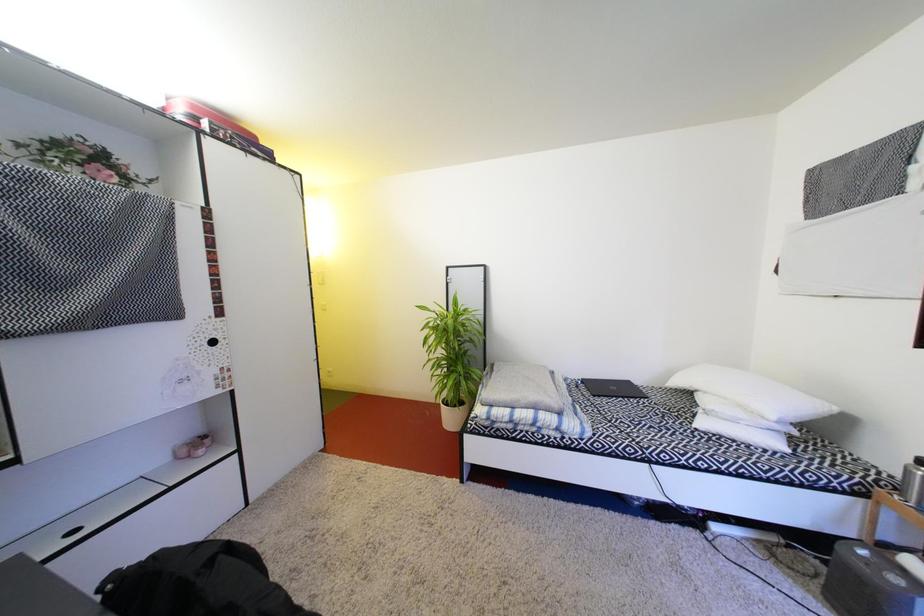
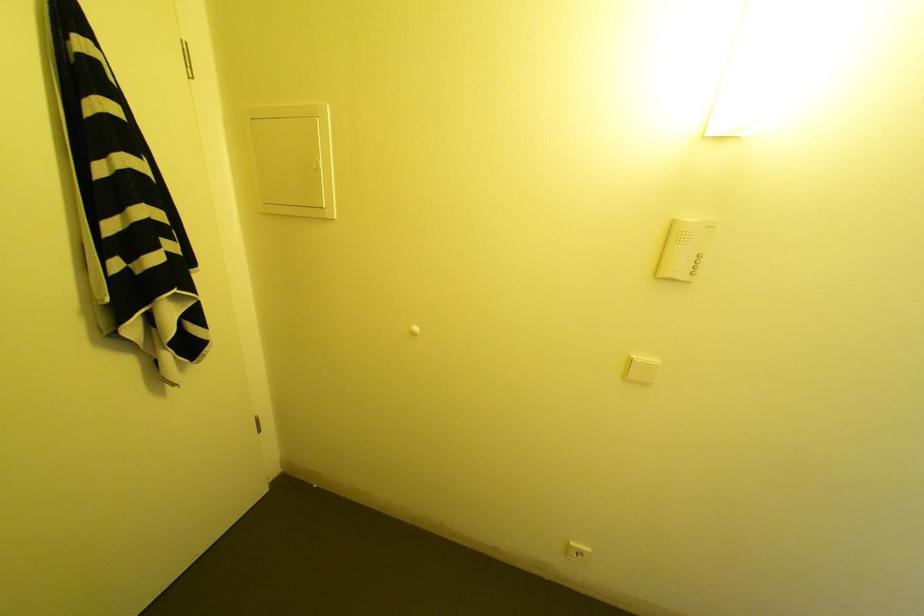
Which direction would the cameraman need to move to produce the second image?

The cameraman walked toward left, forward.